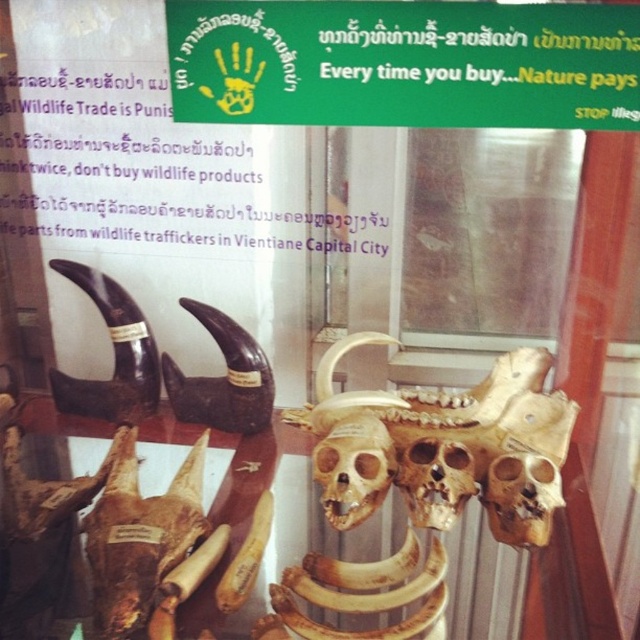
What does the point at coordinates (444, 445) indicate in the image?

The point at coordinates (444, 445) marks the golden bone skull at center.

You are an art curator planning to display the golden bone skull at center and the brown matte skull at center on a shelf. Given their sizes, which one should be placed on the lower shelf to ensure proper visibility?

The brown matte skull at center should be placed on the lower shelf because it is shorter than the golden bone skull at center, allowing both to be visible without obstruction.